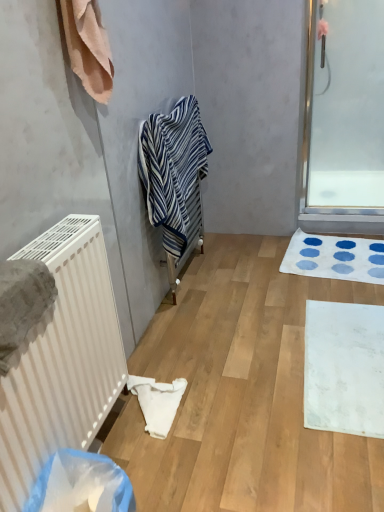
This screenshot has width=384, height=512. Find the location of `free space above white matte bath mat at lower right, arranged as the second bath mat when viewed from the back (from a real-world perspective)`. free space above white matte bath mat at lower right, arranged as the second bath mat when viewed from the back (from a real-world perspective) is located at coordinates (343, 368).